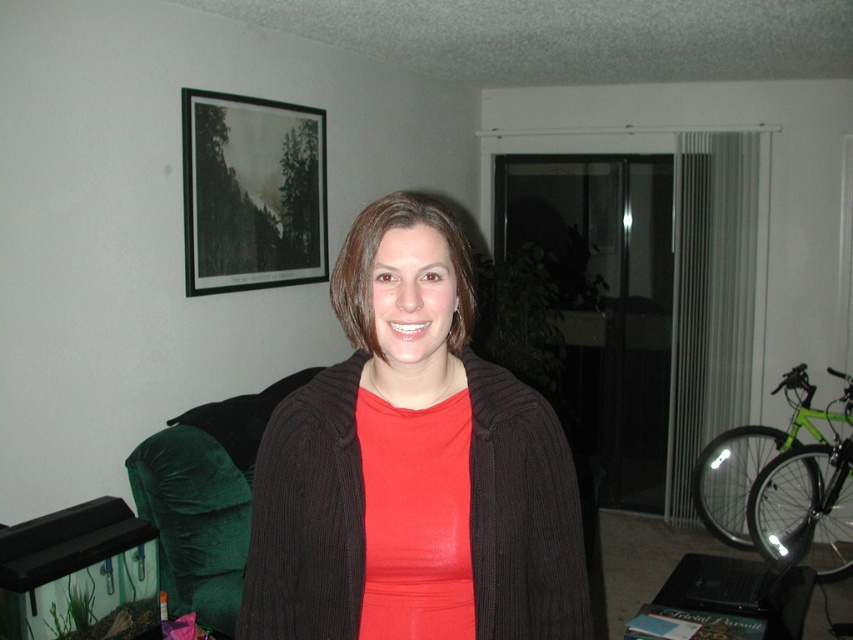
Question: Which object is closer to the camera taking this photo?

Choices:
 (A) velvet green armchair at left
 (B) matte black sweater at center
 (C) black matte picture frame at upper left

Answer: (B)

Question: Based on their relative distances, which object is farther from the velvet green armchair at left?

Choices:
 (A) black matte picture frame at upper left
 (B) matte black sweater at center

Answer: (B)

Question: Which object appears farthest from the camera in this image?

Choices:
 (A) velvet green armchair at left
 (B) black matte picture frame at upper left
 (C) matte black sweater at center

Answer: (B)

Question: Where is matte black sweater at center located in relation to black matte picture frame at upper left in the image?

Choices:
 (A) above
 (B) below

Answer: (B)

Question: Can you confirm if black matte picture frame at upper left is thinner than velvet green armchair at left?

Choices:
 (A) no
 (B) yes

Answer: (B)

Question: Is matte black sweater at center below black matte picture frame at upper left?

Choices:
 (A) yes
 (B) no

Answer: (A)